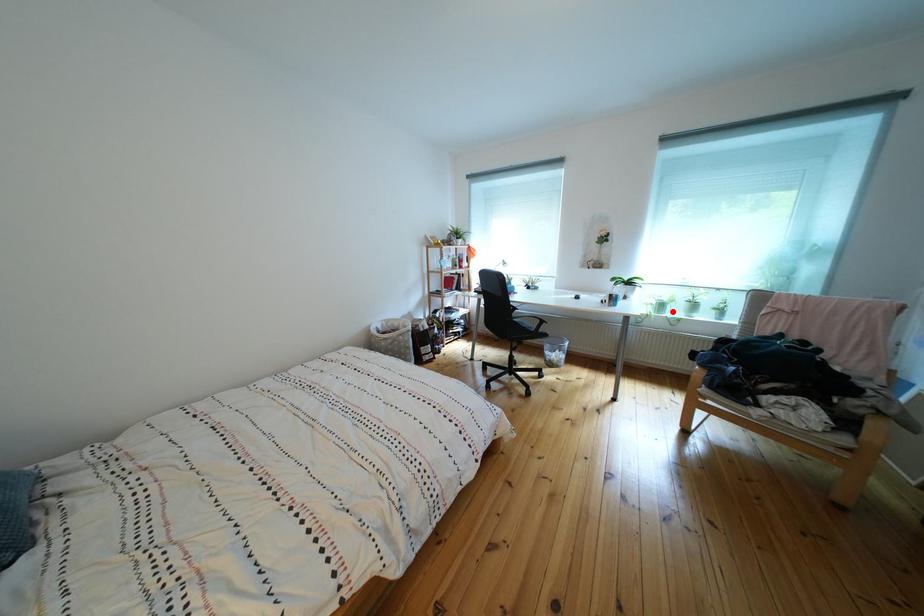
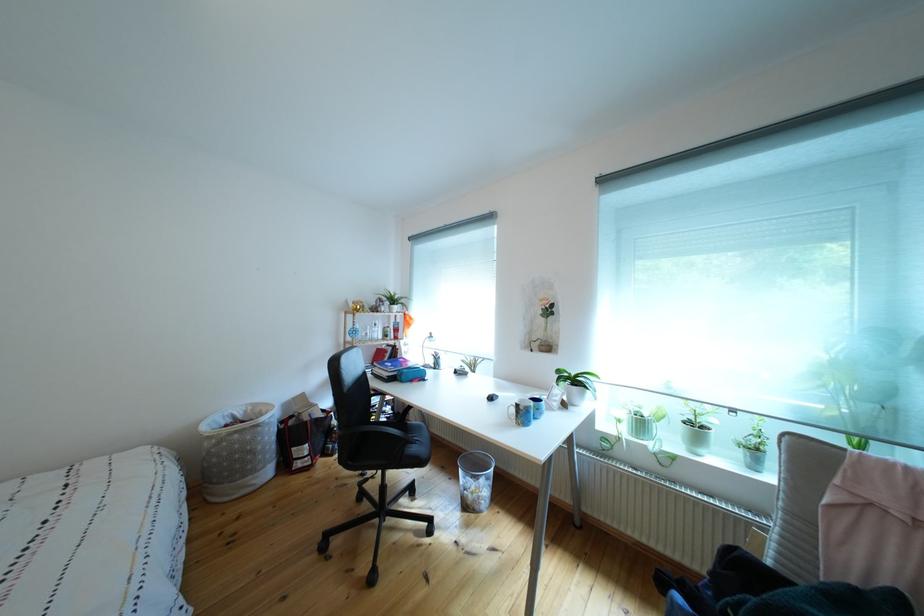
Where in the second image is the point corresponding to the highlighted location from the first image?

(652, 430)